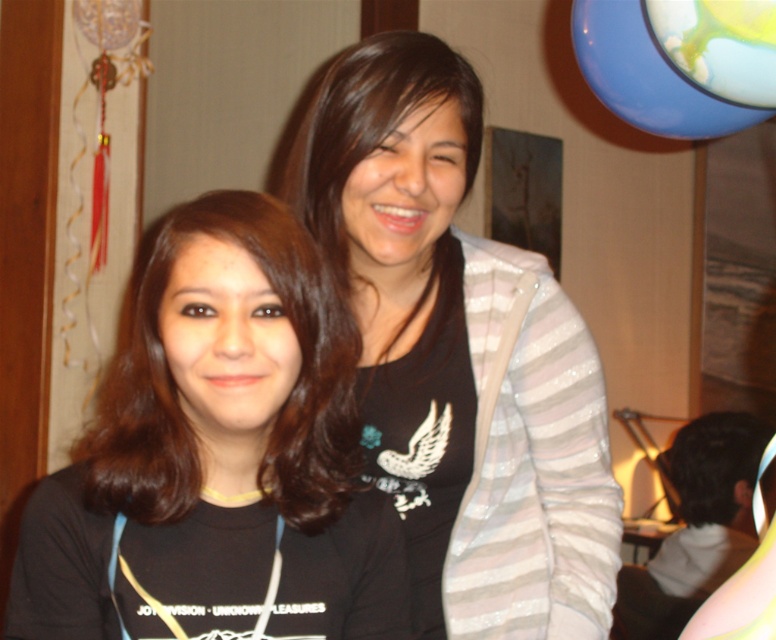
Based on the photo, you are trying to determine which black shirt is visible in the photo between the matte black shirt at center and the black matte shirt at center. Based on their positions, which one is on top?

The matte black shirt at center is positioned over the black matte shirt at center, so the matte black shirt at center is the one visible on top.

You are a photographer adjusting your camera settings to focus on the two people in the image. The matte black shirt at center and the black matte shirt at center are both in your frame. Which of these shirts is closer to your camera?

The matte black shirt at center is closer to the camera because it is further to the viewer than the black matte shirt at center.

From the picture: You are standing in the room and want to find the matte black shirt at center. According to the coordinates given, where would you look to find it?

The matte black shirt at center is located at the 2D coordinates point (456, 353).